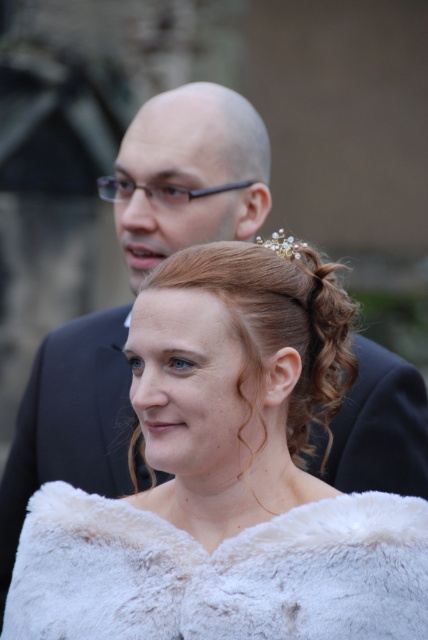
Question: From the image, what is the correct spatial relationship of white fur coat at center in relation to pearl/golden tiara at upper center?

Choices:
 (A) above
 (B) below

Answer: (B)

Question: Among these objects, which one is nearest to the camera?

Choices:
 (A) pearl/golden tiara at upper center
 (B) curly blonde hair at center

Answer: (B)

Question: Which object is the farthest from the curly blonde hair at center?

Choices:
 (A) white fur coat at lower center
 (B) white fur coat at center

Answer: (A)

Question: Can you confirm if white fur coat at lower center is positioned below pearl/golden tiara at upper center?

Choices:
 (A) no
 (B) yes

Answer: (B)

Question: Which object appears closest to the camera in this image?

Choices:
 (A) white fur coat at lower center
 (B) white fur coat at center
 (C) curly blonde hair at center

Answer: (A)

Question: Does white fur coat at lower center have a lesser width compared to pearl/golden tiara at upper center?

Choices:
 (A) yes
 (B) no

Answer: (B)